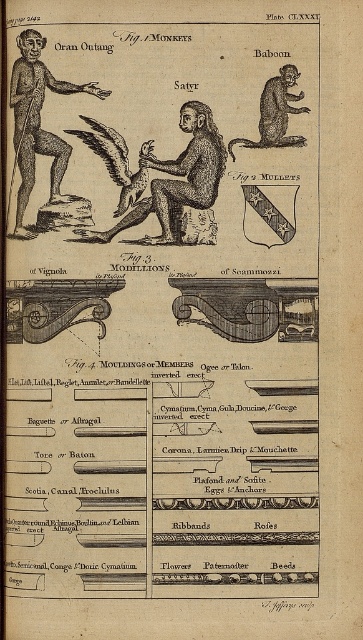
Question: Which point is farther to the camera?

Choices:
 (A) (290, 81)
 (B) (92, 120)
 (C) (31, 236)
 (D) (197, 115)

Answer: (C)

Question: Does brown textured figure at center have a greater width compared to brown fur baboon at upper right?

Choices:
 (A) no
 (B) yes

Answer: (B)

Question: Which object appears farthest from the camera in this image?

Choices:
 (A) brown textured figure at center
 (B) black wood figure at left
 (C) brown wooden eagle at center

Answer: (C)

Question: Which object appears closest to the camera in this image?

Choices:
 (A) brown textured figure at center
 (B) black wood figure at left

Answer: (B)

Question: Observing the image, what is the correct spatial positioning of brown textured figure at center in reference to brown fur baboon at upper right?

Choices:
 (A) above
 (B) below

Answer: (B)

Question: Does brown textured figure at center have a larger size compared to brown fur baboon at upper right?

Choices:
 (A) yes
 (B) no

Answer: (A)